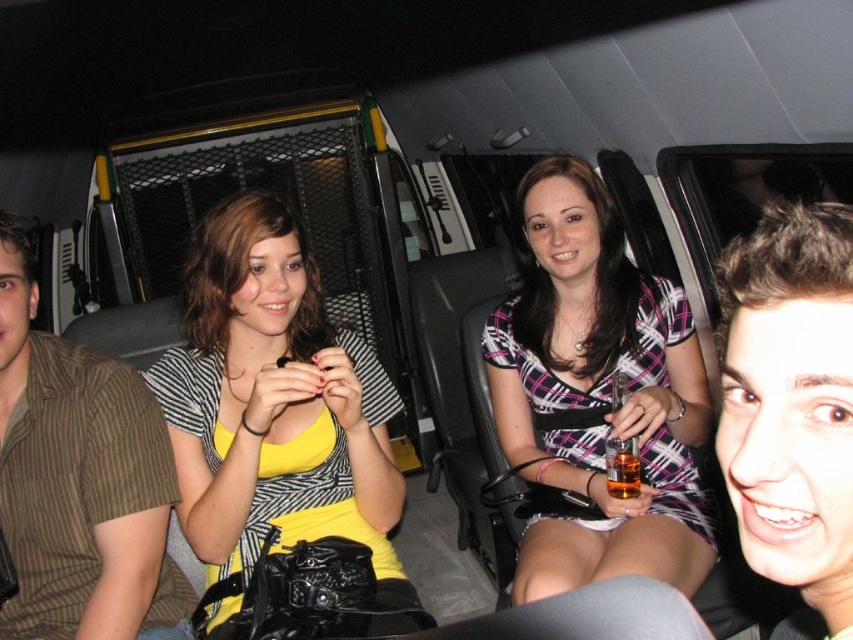
You are a photographer trying to capture a group photo of the yellow fabric dress at center and the brown striped shirt at left. If you want to ensure both subjects are in focus, which one should you adjust your camera focus to prioritize based on their positions?

The yellow fabric dress at center is taller than the brown striped shirt at left, so you should prioritize focusing on the yellow fabric dress at center to ensure both are in focus.

You are a passenger in the vehicle and need to determine the spatial relationship between the person wearing the brown striped shirt and the plaid fabric dress at center. Based on the scene description, which object is positioned to the left of the other?

The person wearing the brown striped shirt is positioned to the left of the plaid fabric dress at center, as the brown striped shirt is in the foreground on the left side of the frame, while the plaid fabric dress at center is located at point coordinates indicating a central position.